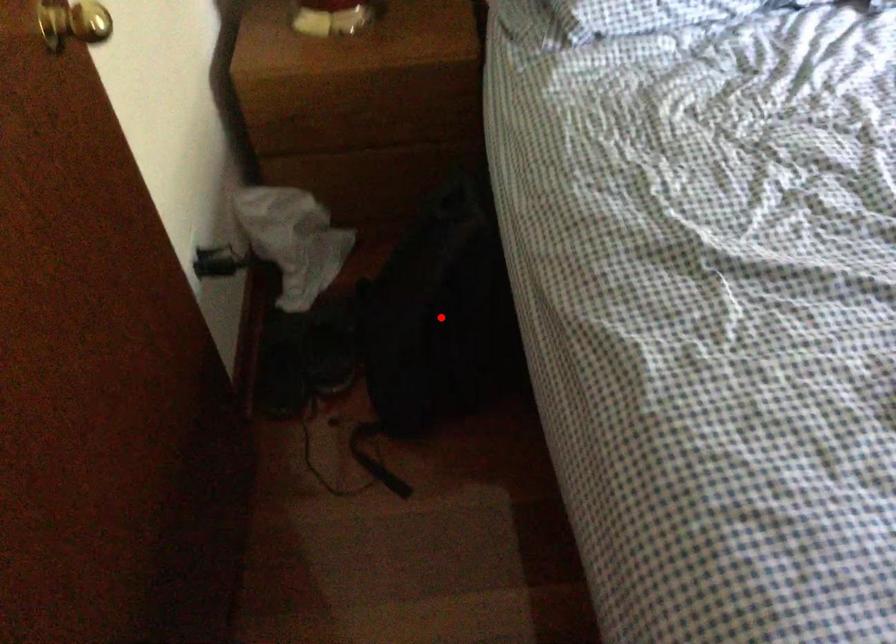
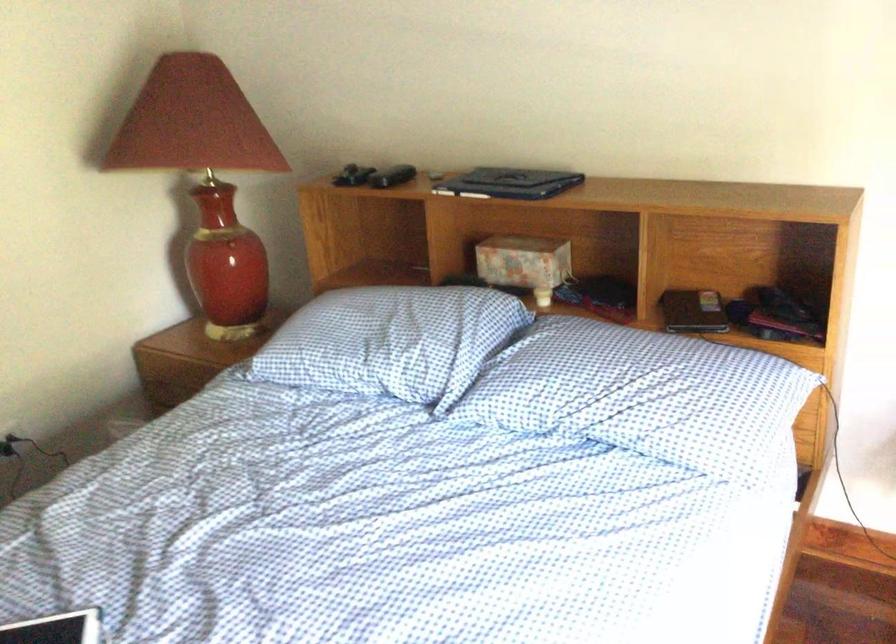
Question: I am providing you with two images of the same scene from different viewpoints. A red point is marked on the first image. At the location where the point appears in image 1, is it still visible in image 2?

Choices:
 (A) Yes
 (B) No

Answer: (B)